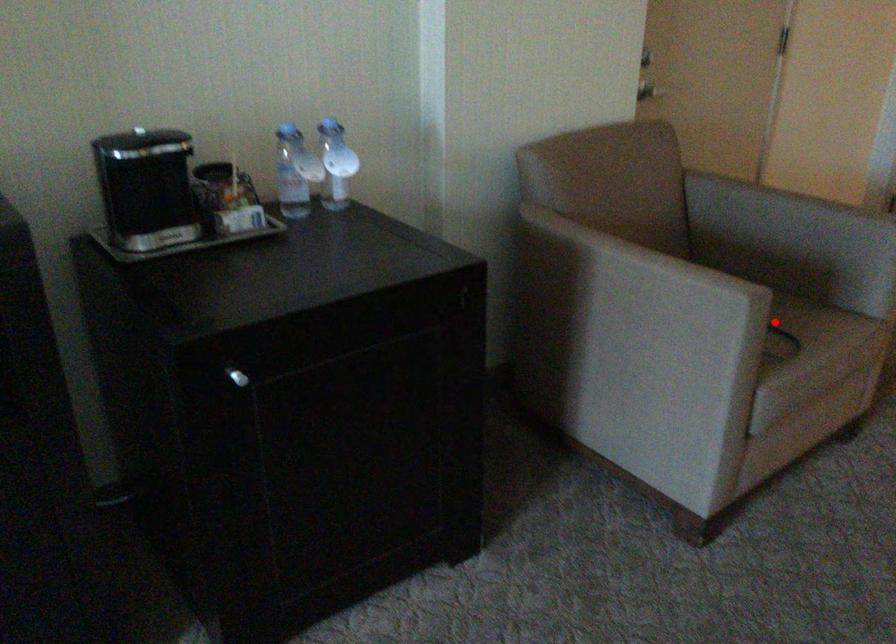
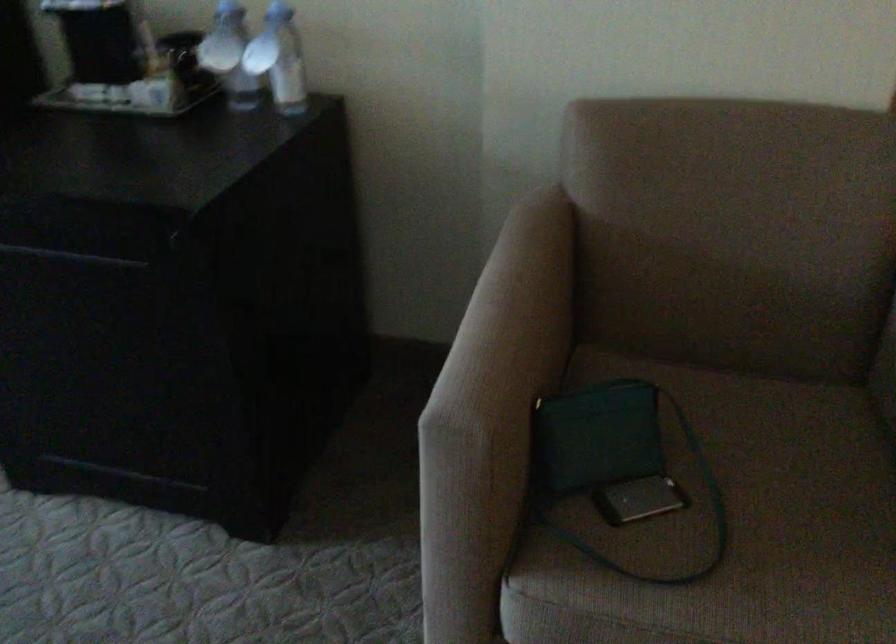
Locate, in the second image, the point that corresponds to the highlighted location in the first image.

(729, 526)